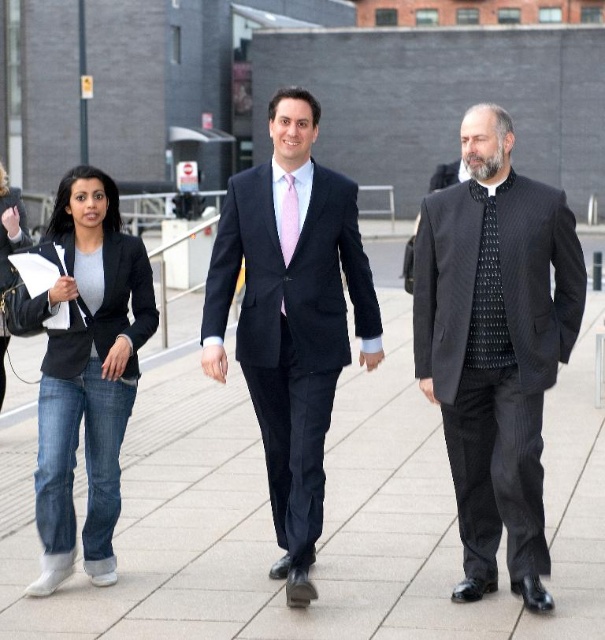
In the scene shown: You are standing on the sidewalk and see the paved stone pavement at center and the denim jeans at left. Which object is located to the right of the other?

The paved stone pavement at center is to the right of denim jeans at left.

Based on the scene description, can you determine which object is taller between the matte black suit at center and the black textured tie at center?

The matte black suit at center is taller than the black textured tie at center according to the description.